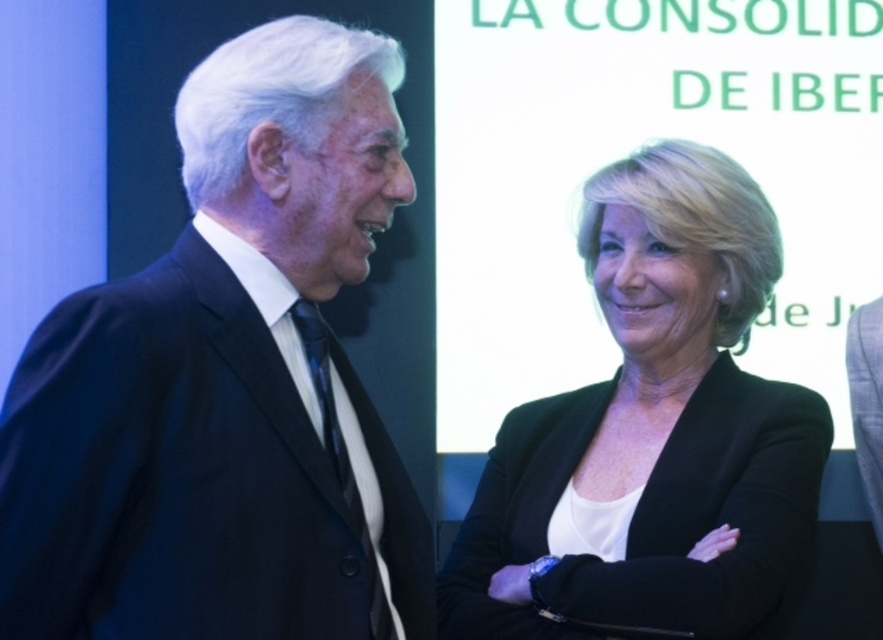
You are a fashion designer observing two suits displayed in a store window. The black matte suit at center and the light blue wool suit at right. Which one is wider?

The black matte suit at center is wider than the light blue wool suit at right.

You are standing in the room where the man and woman are. You want to touch the point at coordinates point (146, 634). Can you reach it without moving your position?

The point (146, 634) is 5.83 feet away from the viewer, so yes, you can reach it without moving your position if your arm can extend that far.

You are a fashion designer observing the scene. You need to decide which garment is covering another. Which one is on top between the black matte blazer at center and the light blue wool suit at right?

The black matte blazer at center is positioned over the light blue wool suit at right, so the black matte blazer at center is on top.